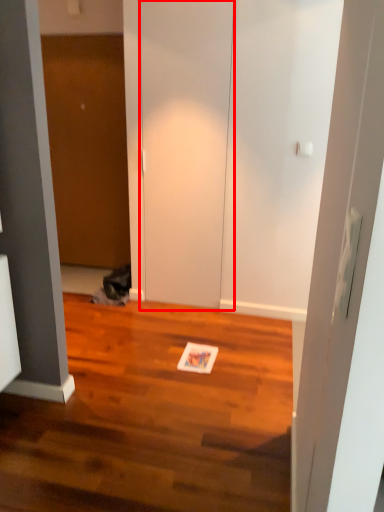
Question: From the image's perspective, where is door (annotated by the red box) located relative to door?

Choices:
 (A) below
 (B) above

Answer: (A)